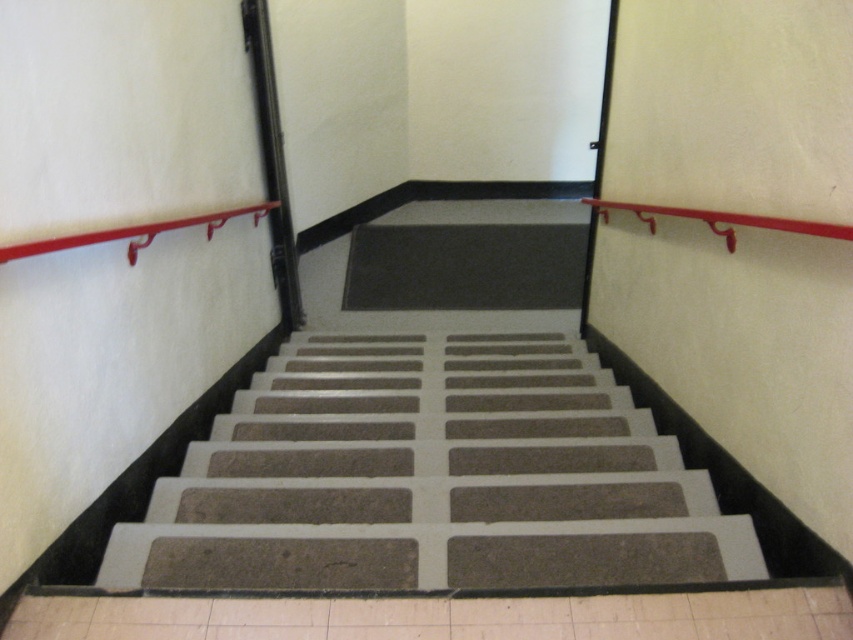
Question: Does matte red handrail at upper left lie in front of metallic red handrail at upper right?

Choices:
 (A) no
 (B) yes

Answer: (B)

Question: Where is textured gray carpet at center located in relation to matte red handrail at upper left in the image?

Choices:
 (A) right
 (B) left

Answer: (A)

Question: Can you confirm if textured gray carpet at center is positioned to the right of metallic red handrail at upper right?

Choices:
 (A) yes
 (B) no

Answer: (B)

Question: Which of these objects is positioned farthest from the metallic red handrail at upper right?

Choices:
 (A) matte red handrail at upper left
 (B) textured gray carpet at center

Answer: (A)

Question: Which object is farther from the camera taking this photo?

Choices:
 (A) textured gray carpet at center
 (B) matte red handrail at upper left
 (C) metallic red handrail at upper right

Answer: (A)

Question: Estimate the real-world distances between objects in this image. Which object is closer to the metallic red handrail at upper right?

Choices:
 (A) matte red handrail at upper left
 (B) textured gray carpet at center

Answer: (B)